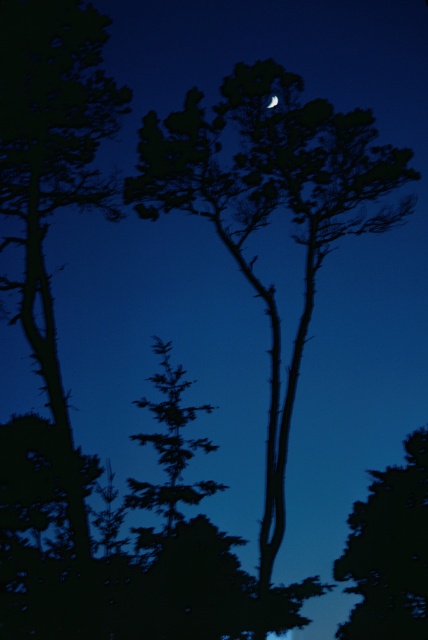
From the picture: You are navigating through a dark forest at night. You see two glowing points of light in the distance. One is at point [121,99] and the other is at point [413,504]. Which point is closer to you?

Point [121,99] is in front of point [413,504], so it is closer to you.